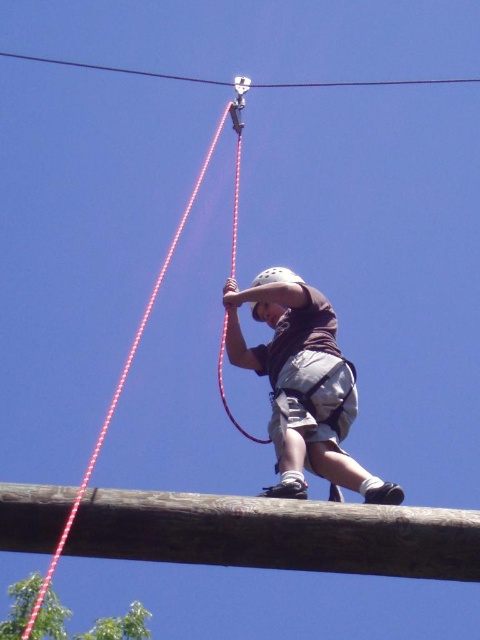
Question: Observing the image, what is the correct spatial positioning of metallic wire at upper center in reference to red rope at center?

Choices:
 (A) above
 (B) below

Answer: (A)

Question: Is matte brown shirt at center positioned behind red cord at upper center?

Choices:
 (A) no
 (B) yes

Answer: (B)

Question: Which object is closer to the camera taking this photo?

Choices:
 (A) metallic wire at upper center
 (B) red rope at center
 (C) brown rough wood beam at center
 (D) matte brown shirt at center

Answer: (C)

Question: Does brown rough wood beam at center appear under matte brown shirt at center?

Choices:
 (A) no
 (B) yes

Answer: (B)

Question: Which object is the farthest from the brown rough wood beam at center?

Choices:
 (A) matte brown shirt at center
 (B) metallic wire at upper center
 (C) red cord at upper center

Answer: (B)

Question: Which of the following is the closest to the observer?

Choices:
 (A) (136, 497)
 (B) (58, 547)

Answer: (B)